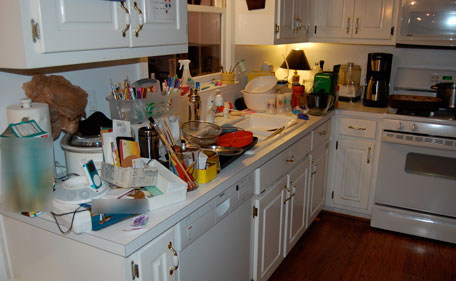
Locate an element on the screen. dishwasher is located at coordinates [x=214, y=242].